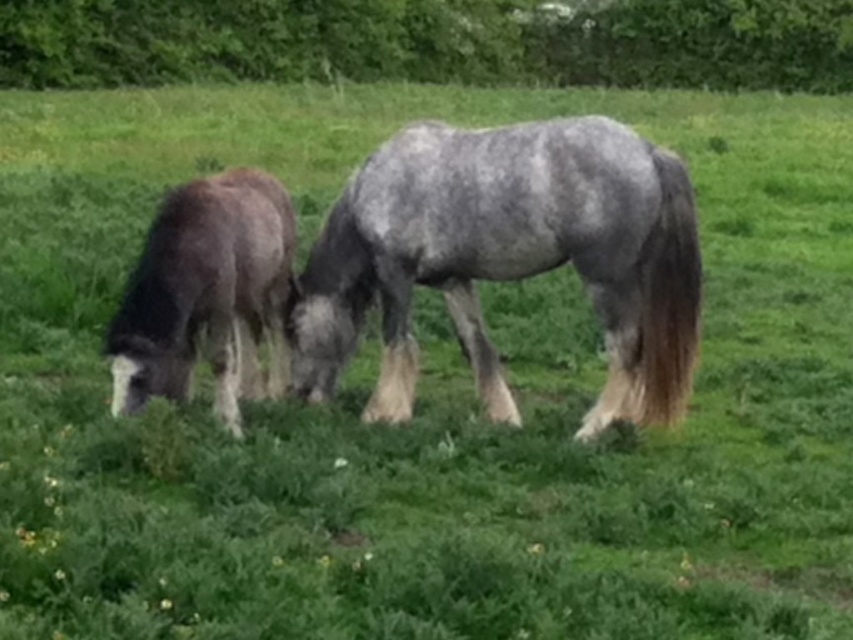
Question: Can you confirm if speckled gray horse at center is positioned below dark brown fur at left?

Choices:
 (A) no
 (B) yes

Answer: (A)

Question: Among these points, which one is nearest to the camera?

Choices:
 (A) (154, 230)
 (B) (624, 412)

Answer: (A)

Question: Is speckled gray horse at center thinner than dark brown fur at left?

Choices:
 (A) no
 (B) yes

Answer: (A)

Question: Does speckled gray horse at center lie behind dark brown fur at left?

Choices:
 (A) yes
 (B) no

Answer: (A)